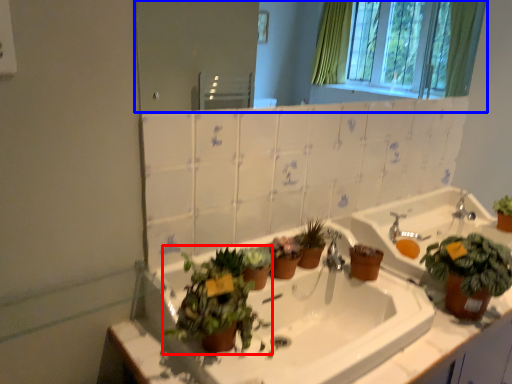
Question: Among these objects, which one is nearest to the camera, houseplant (highlighted by a red box) or mirror (highlighted by a blue box)?

Choices:
 (A) houseplant
 (B) mirror

Answer: (A)